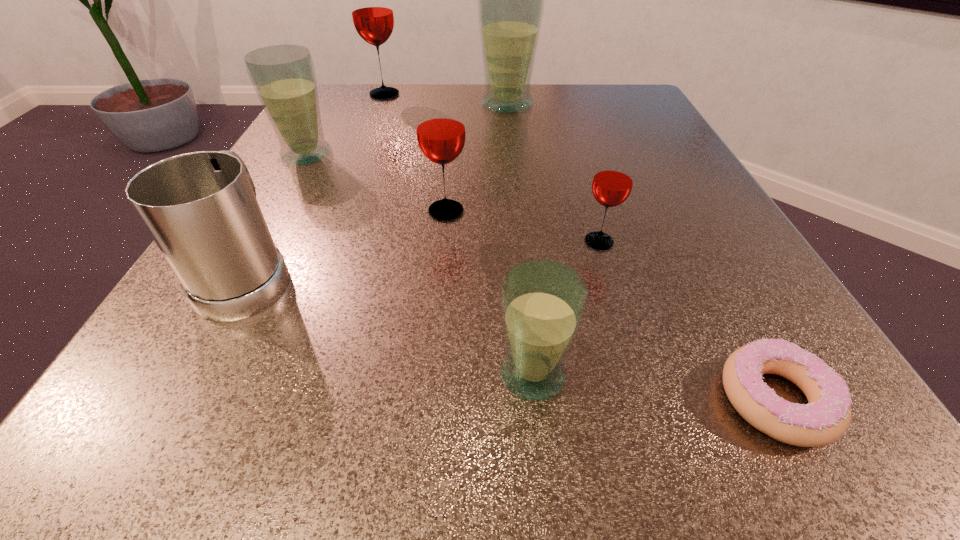
The height and width of the screenshot is (540, 960). I want to click on the second glass from left to right, so click(372, 13).

This screenshot has width=960, height=540. Find the location of `the biggest red glass`. the biggest red glass is located at coordinates (372, 13).

The height and width of the screenshot is (540, 960). I want to click on the biggest blue glass, so click(x=510, y=0).

Where is `the leftmost glass`? This screenshot has height=540, width=960. the leftmost glass is located at coordinates [283, 76].

Where is `the second smallest blue glass`? Image resolution: width=960 pixels, height=540 pixels. the second smallest blue glass is located at coordinates (283, 76).

Identify the location of the second farthest red glass. The height and width of the screenshot is (540, 960). [x=440, y=126].

This screenshot has height=540, width=960. I want to click on the third nearest glass, so click(440, 126).

Where is `mug`? mug is located at coordinates (200, 208).

At what (x,y) coordinates should I click in order to perform the action: click on the smallest red glass. Please return your answer as a coordinate pair (x, y). This screenshot has height=540, width=960. Looking at the image, I should click on (612, 184).

Find the location of a particular element. The height and width of the screenshot is (540, 960). the seventh object from left to right is located at coordinates (612, 184).